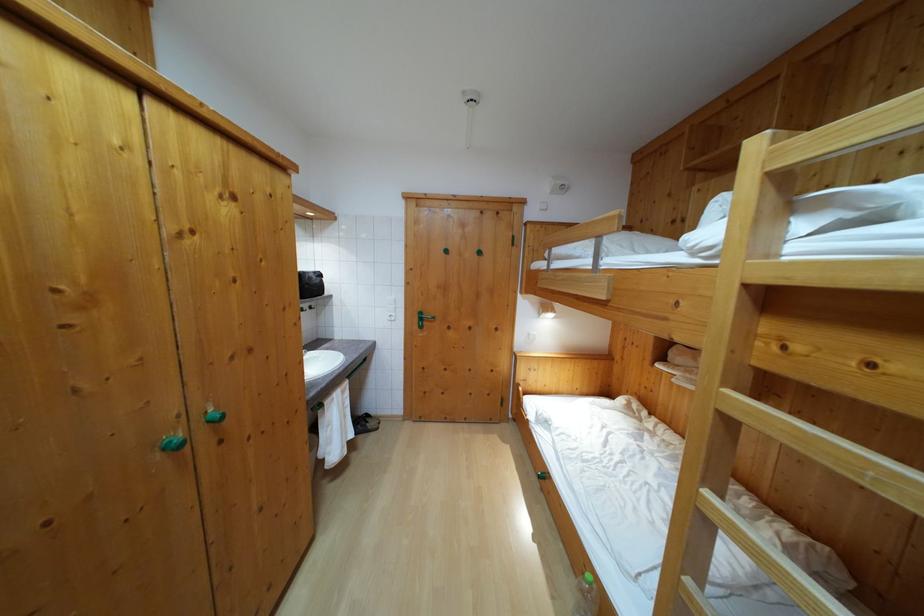
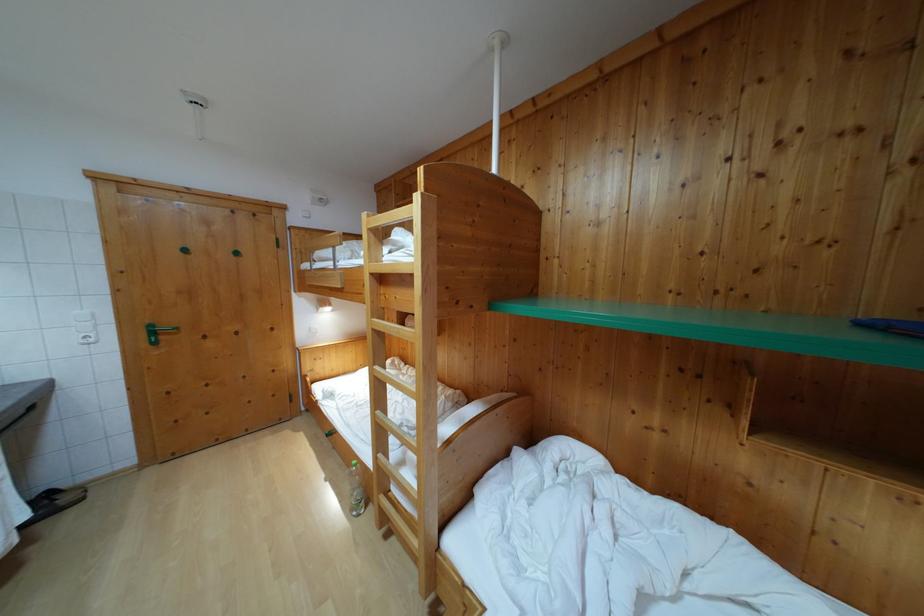
Find the pixel in the second image that matches the point at 424,320 in the first image.

(155, 333)